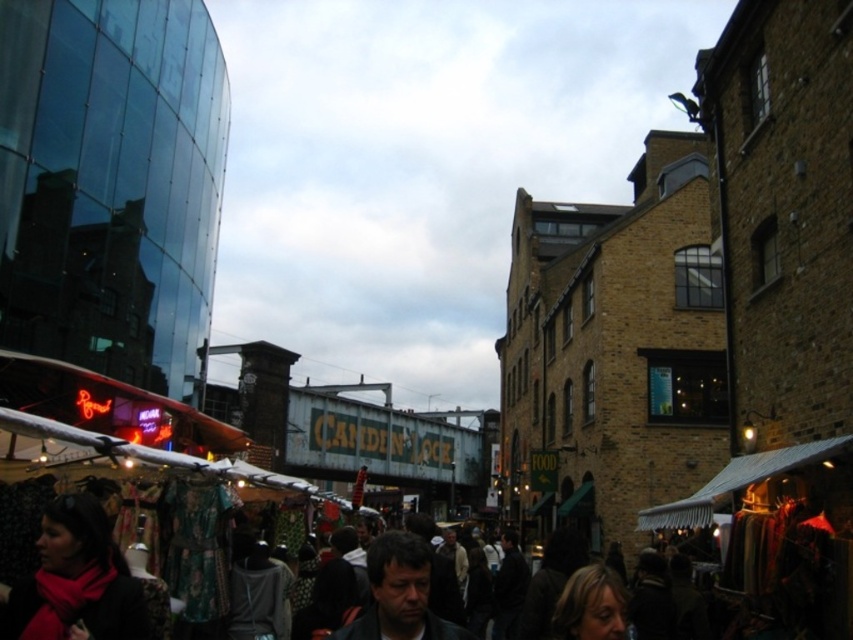
Is point (71, 540) positioned in front of point (380, 620)?

Yes, it is.

Does matte red scarf at lower left have a lesser width compared to dark brown hair at center?

Correct, matte red scarf at lower left's width is less than dark brown hair at center's.

Between point (119, 630) and point (360, 634), which one is positioned behind?

The point (360, 634) is behind.

Image resolution: width=853 pixels, height=640 pixels. I want to click on matte red scarf at lower left, so click(74, 580).